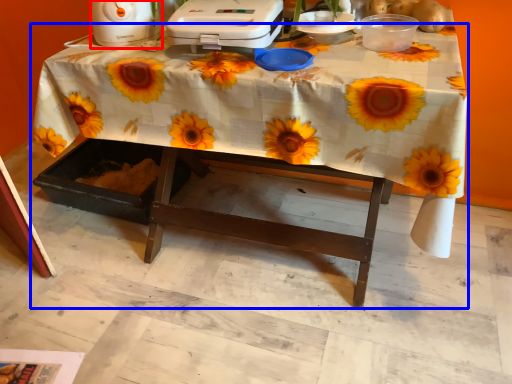
Question: Which object appears closest to the camera in this image, appliance (highlighted by a red box) or table (highlighted by a blue box)?

Choices:
 (A) appliance
 (B) table

Answer: (B)